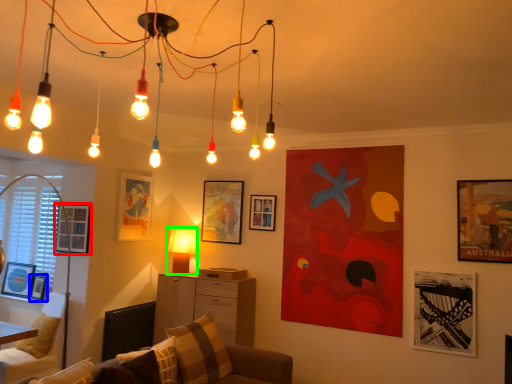
Question: Estimate the real-world distances between objects in this image. Which object is closer to picture frame (highlighted by a red box), picture frame (highlighted by a blue box) or lamp (highlighted by a green box)?

Choices:
 (A) picture frame
 (B) lamp

Answer: (A)